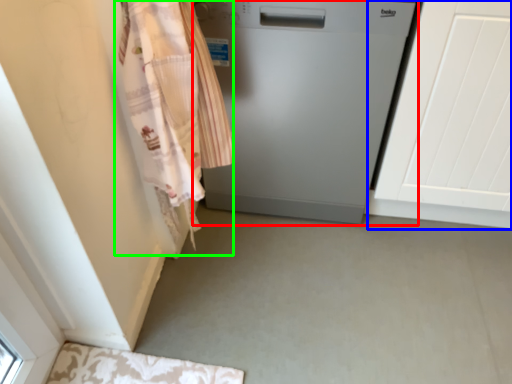
Question: Estimate the real-world distances between objects in this image. Which object is closer to home appliance (highlighted by a red box), screen door (highlighted by a blue box) or clothing (highlighted by a green box)?

Choices:
 (A) screen door
 (B) clothing

Answer: (A)